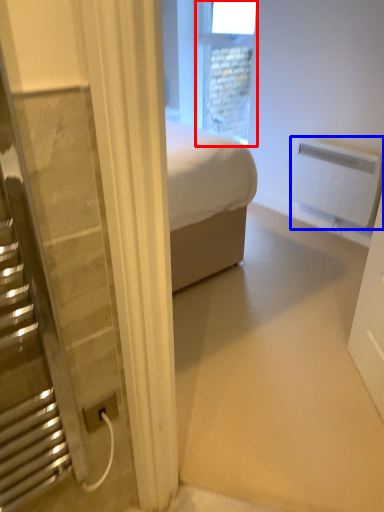
Question: Which point is closer to the camera, window (highlighted by a red box) or radiator (highlighted by a blue box)?

Choices:
 (A) window
 (B) radiator

Answer: (B)